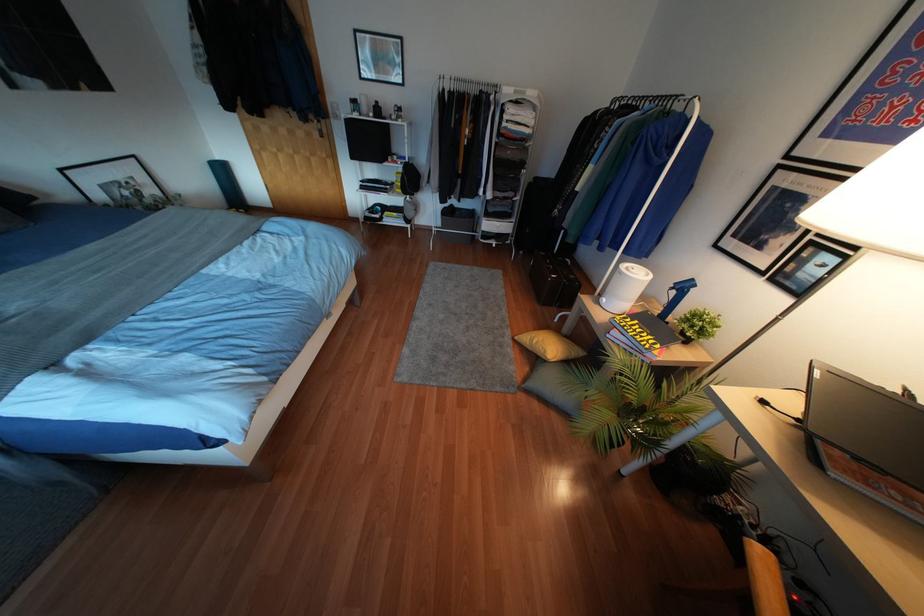
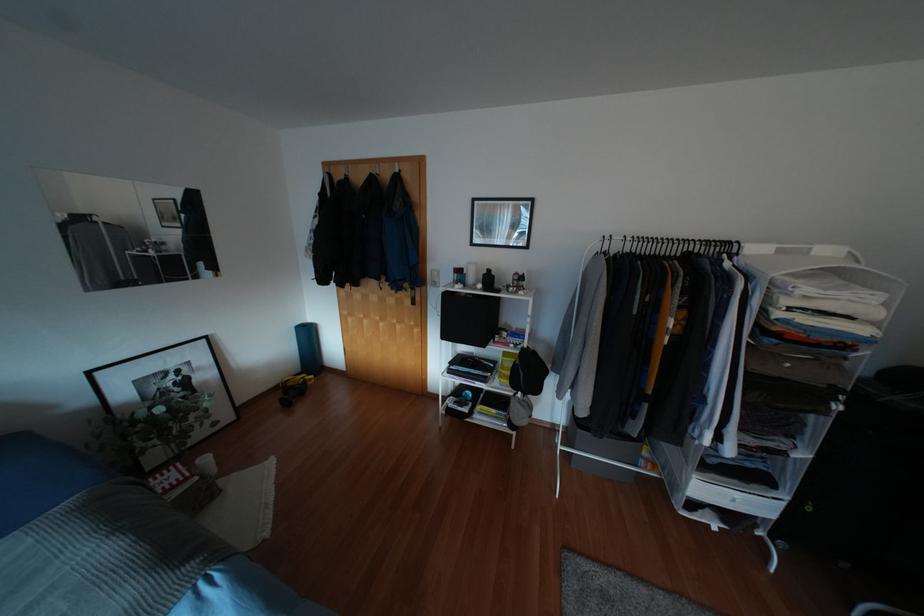
In the second image, find the point that corresponds to (373,116) in the first image.

(483, 289)